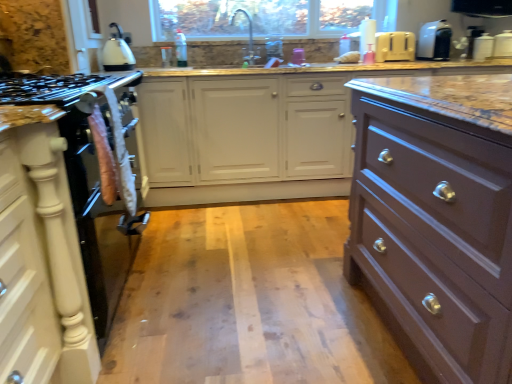
Question: Is white plastic toaster at upper right, the 4th appliance positioned from the right, taller or shorter than satin brown drawer at right?

Choices:
 (A) short
 (B) tall

Answer: (A)

Question: Is white plastic toaster at upper right, which is counted as the first appliance, starting from the left, to the left or to the right of satin brown drawer at right in the image?

Choices:
 (A) right
 (B) left

Answer: (A)

Question: Estimate the real-world distances between objects in this image. Which object is farther from the white matte cabinet at left?

Choices:
 (A) white plastic container at upper right, acting as the 4th appliance starting from the left
 (B) white plastic toaster at upper right, the second appliance viewed from the left
 (C) white glossy kettle at upper left
 (D) marble countertop at center
 (E) satin brown drawer at right

Answer: (A)

Question: Estimate the real-world distances between objects in this image. Which object is closer to the white glossy kettle at upper left?

Choices:
 (A) white glossy toaster at upper right, the third appliance in the left-to-right sequence
 (B) white matte cabinet at left
 (C) white plastic container at upper right, acting as the 4th appliance starting from the left
 (D) white plastic toaster at upper right, the 4th appliance positioned from the right
 (E) satin nickel faucet at upper center

Answer: (E)